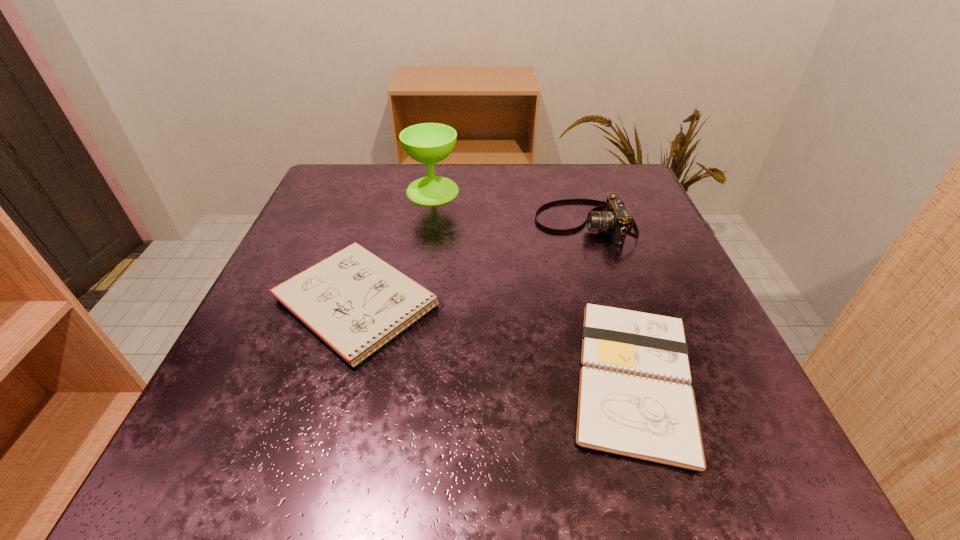
The height and width of the screenshot is (540, 960). I want to click on free space between the shorter notepad and the left notepad, so click(x=496, y=340).

Locate an element on the screen. This screenshot has width=960, height=540. free space between the shortest object and the wineglass is located at coordinates (534, 284).

Find the location of a particular element. The width and height of the screenshot is (960, 540). empty space that is in between the shortest object and the second shortest object is located at coordinates (496, 340).

Identify the location of free space between the camera and the tallest object. The height and width of the screenshot is (540, 960). (509, 207).

You are a GUI agent. You are given a task and a screenshot of the screen. Output one action in this format:
    pyautogui.click(x=<x>, y=<y>)
    Task: Click on the free space between the camera and the tallest object
    Image resolution: width=960 pixels, height=540 pixels.
    Given the screenshot: What is the action you would take?
    pyautogui.click(x=509, y=207)

You are a GUI agent. You are given a task and a screenshot of the screen. Output one action in this format:
    pyautogui.click(x=<x>, y=<y>)
    Task: Click on the free space between the camera and the second shortest object
    
    Given the screenshot: What is the action you would take?
    pyautogui.click(x=471, y=263)

The height and width of the screenshot is (540, 960). Identify the location of object that is the closest one to the tallest object. (353, 300).

Point out which object is positioned as the second nearest to the right notepad. Please provide its 2D coordinates. Your answer should be formatted as a tuple, i.e. [(x, y)], where the tuple contains the x and y coordinates of a point satisfying the conditions above.

[(353, 300)]

The height and width of the screenshot is (540, 960). Find the location of `blank area in the image that satisfies the following two spatial constraints: 1. on the back side of the wineglass; 2. on the left side of the taller notepad`. blank area in the image that satisfies the following two spatial constraints: 1. on the back side of the wineglass; 2. on the left side of the taller notepad is located at coordinates (390, 191).

Where is `free region that satisfies the following two spatial constraints: 1. on the front side of the taller notepad; 2. on the left side of the shorter notepad`? Image resolution: width=960 pixels, height=540 pixels. free region that satisfies the following two spatial constraints: 1. on the front side of the taller notepad; 2. on the left side of the shorter notepad is located at coordinates (336, 377).